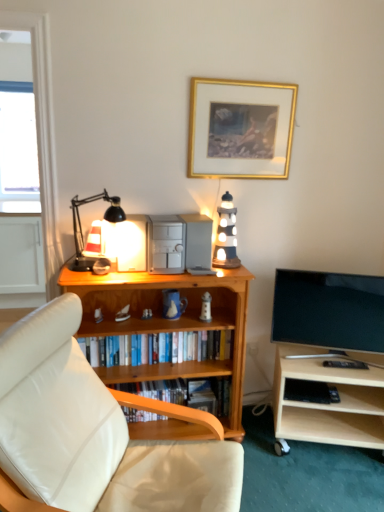
Question: From the image's perspective, relative to wooden bookshelf at center, the 3th book when ordered from bottom to top, is wooden lighthouse at center above or below?

Choices:
 (A) below
 (B) above

Answer: (B)

Question: In the image, is wooden lighthouse at center positioned in front of or behind wooden bookshelf at center, the 3th book when ordered from bottom to top?

Choices:
 (A) behind
 (B) front

Answer: (B)

Question: Based on their relative distances, which object is nearer to the wooden lighthouse at center?

Choices:
 (A) light wood tv stand at lower right
 (B) flat screen tv at right
 (C) transparent glass door at left
 (D) transparent glass window at upper left
 (E) matte black table lamp at left

Answer: (B)

Question: Estimate the real-world distances between objects in this image. Which object is closer to the matte black table lamp at left?

Choices:
 (A) wooden bookcase at center
 (B) wooden lighthouse at center
 (C) transparent glass door at left
 (D) transparent glass window at upper left
 (E) gold metallic picture frame at upper center

Answer: (C)